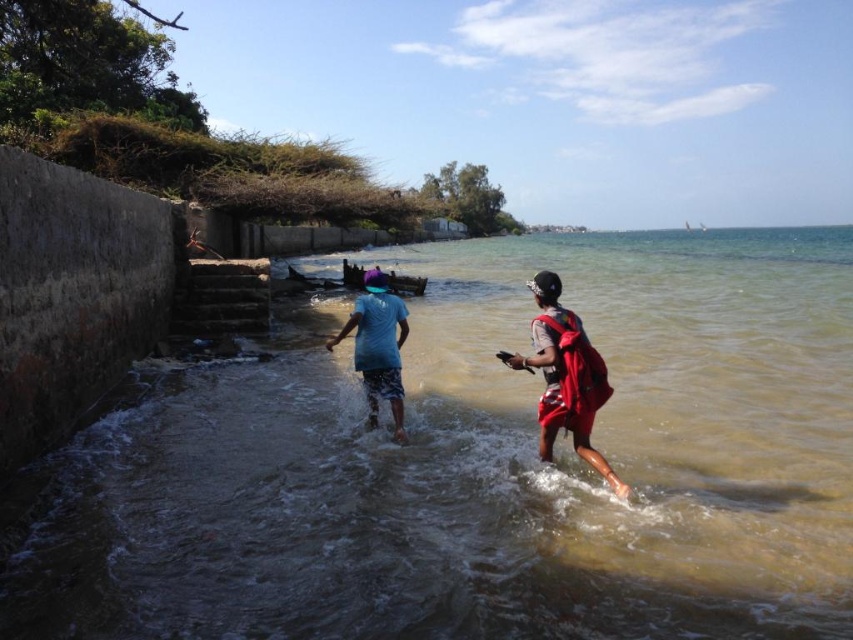
Is red fabric bag at center wider than blue cotton shirt at center?

Yes, red fabric bag at center is wider than blue cotton shirt at center.

Who is higher up, red fabric bag at center or blue cotton shirt at center?

Positioned higher is blue cotton shirt at center.

This screenshot has width=853, height=640. Identify the location of red fabric bag at center. (566, 376).

Measure the distance from brown murky water at center to blue fabric shirt at center.

brown murky water at center is 31.09 meters from blue fabric shirt at center.

Identify the location of brown murky water at center. The image size is (853, 640). (489, 468).

Who is more distant from viewer, (700,570) or (553,353)?

The point (553,353) is behind.

This screenshot has height=640, width=853. Identify the location of brown murky water at center. (489, 468).

Between point (561, 400) and point (622, 486), which one is positioned in front?

Point (622, 486) is more forward.

Does blue fabric shirt at center appear over red fabric bag at center?

Yes.

Describe the element at coordinates (566, 376) in the screenshot. I see `blue fabric shirt at center` at that location.

What are the coordinates of `blue fabric shirt at center` in the screenshot? It's located at (566, 376).